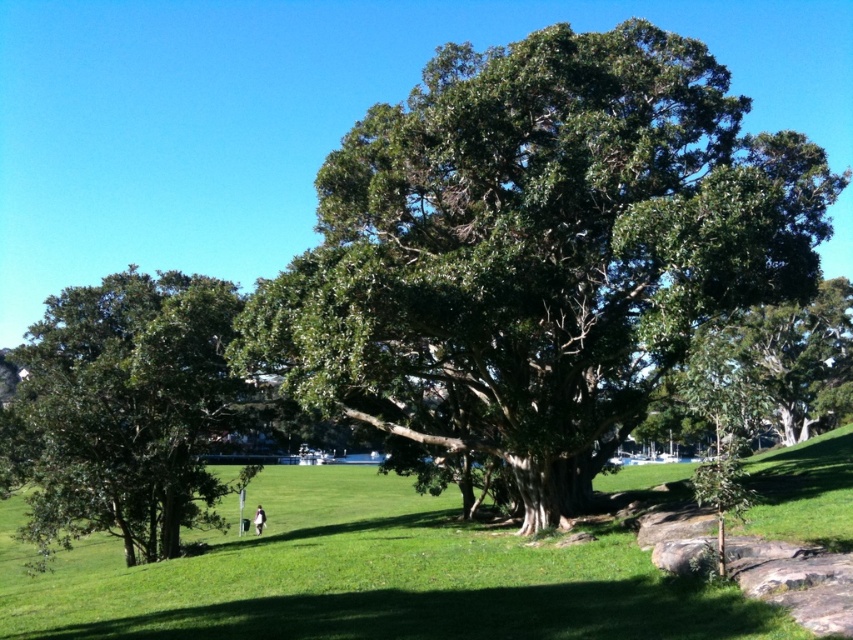
Which of these two, green leafy oak tree at center or green glossy tree at left, stands shorter?

Standing shorter between the two is green leafy oak tree at center.

Between green leafy oak tree at center and green glossy tree at left, which one is positioned lower?

green glossy tree at left is lower down.

Which is behind, point (521, 353) or point (141, 454)?

Positioned behind is point (141, 454).

This screenshot has width=853, height=640. I want to click on green leafy oak tree at center, so click(537, 250).

Does green glossy tree at left have a lesser width compared to white fabric bag at lower center?

In fact, green glossy tree at left might be wider than white fabric bag at lower center.

In the scene shown: Between green glossy tree at left and white fabric bag at lower center, which one has less height?

white fabric bag at lower center is shorter.

Identify the location of green glossy tree at left. This screenshot has width=853, height=640. (125, 410).

Between green grassy at center and green glossy tree at left, which one appears on the right side from the viewer's perspective?

green grassy at center

Does green grassy at center have a greater width compared to green glossy tree at left?

Correct, the width of green grassy at center exceeds that of green glossy tree at left.

Is point (254, 556) farther from camera compared to point (68, 534)?

No, it is in front of (68, 534).

Identify the location of green grassy at center. (367, 577).